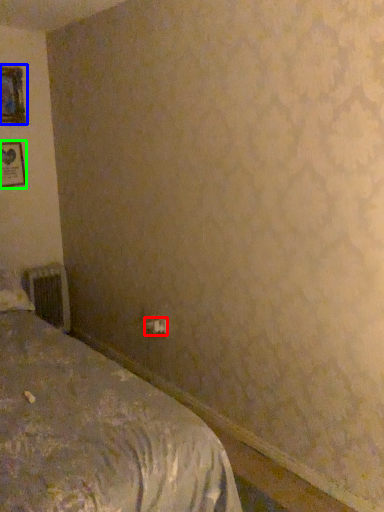
Question: Which is farther away from electric outlet (highlighted by a red box)? picture frame (highlighted by a blue box) or picture frame (highlighted by a green box)?

Choices:
 (A) picture frame
 (B) picture frame

Answer: (A)